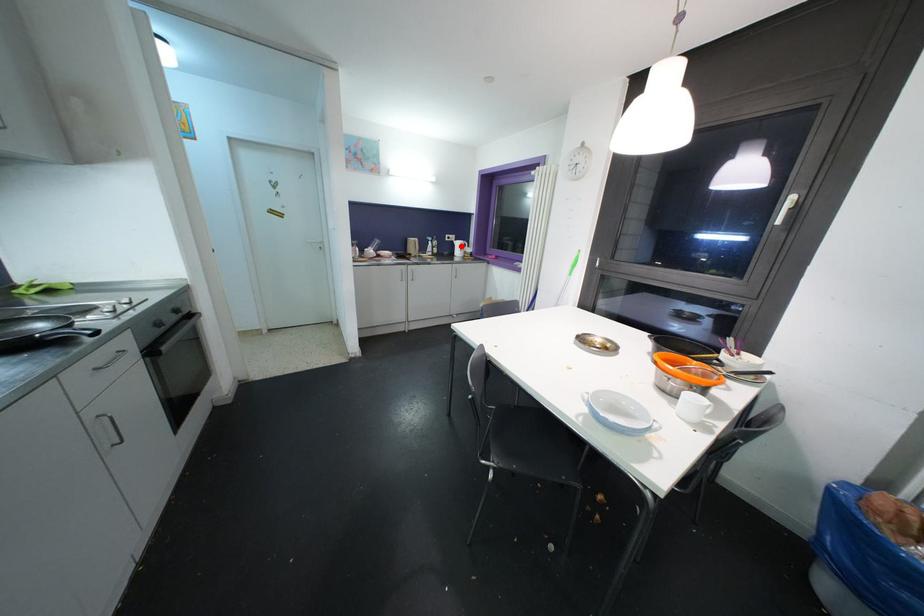
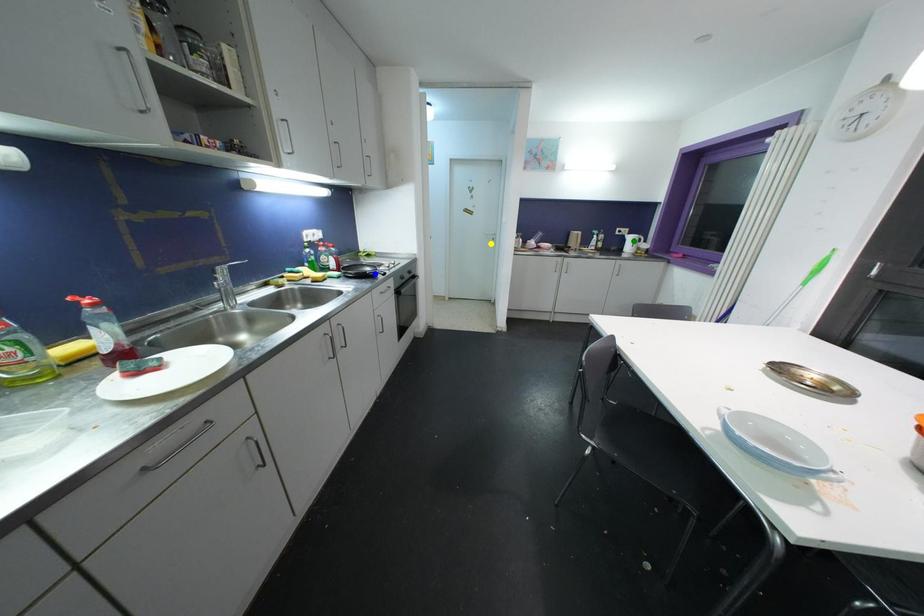
Question: I am providing you with two images of the same scene from different viewpoints. A red point is marked on the first image. You are given multiple points on the second image. Which point in image 2 is actually the same real-world point as the red point in image 1?

Choices:
 (A) yellow point
 (B) blue point
 (C) green point

Answer: (C)